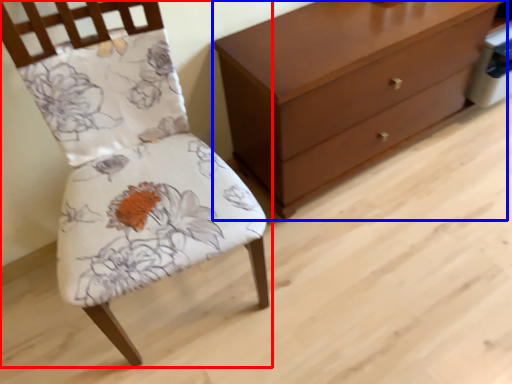
Question: Among these objects, which one is nearest to the camera, chair (highlighted by a red box) or chest of drawers (highlighted by a blue box)?

Choices:
 (A) chair
 (B) chest of drawers

Answer: (A)